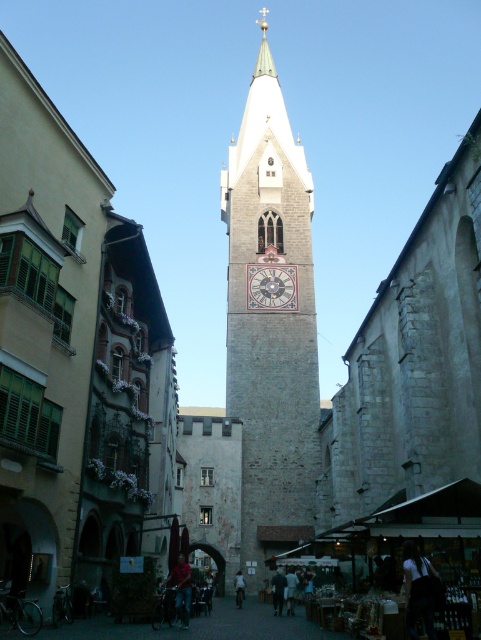
You are a tourist standing in front of the historic urban scene. You want to take a photo that includes both the white stone clock tower at center and the white painted stone clock at center. Given that your camera can capture a maximum distance of 30 feet between the nearest and farthest objects in focus, will you be able to get both objects in focus in a single photo?

The white stone clock tower at center and white painted stone clock at center are 33.49 feet apart from each other. Since the distance exceeds the camera maximum of 30 feet, you will not be able to get both objects in focus in a single photo.

You are an architect examining the historic urban scene. You notice the white stone clock tower at center and the white painted stone clock at center. Which structure is taller?

The white stone clock tower at center is taller than the white painted stone clock at center.

You are an architect designing a new building that needs to align with the proportions of the historic district. You observe the white stone clock tower at center and the white painted stone clock at center in the image. Which of these two has a greater width?

The white stone clock tower at center has a greater width than the white painted stone clock at center, as stated in the description.